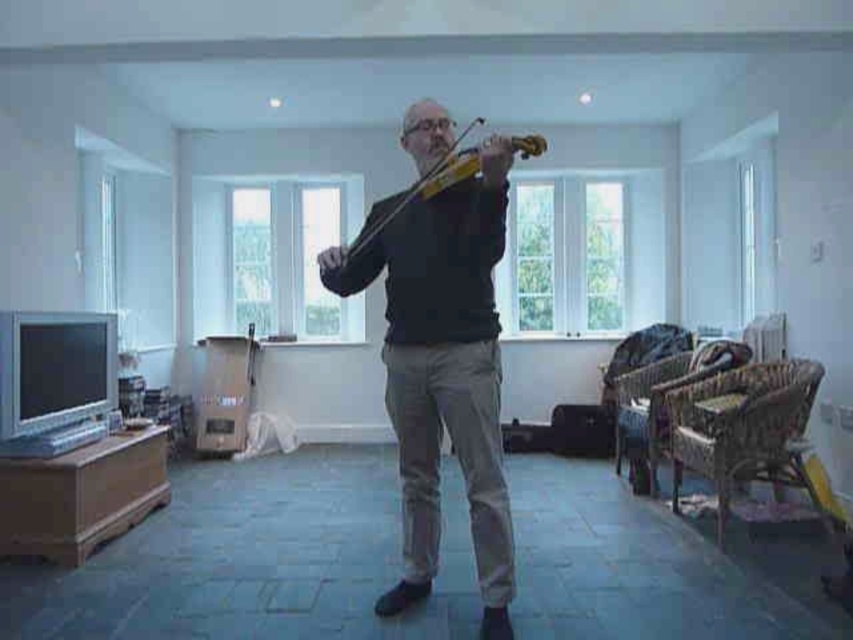
You are standing in the room and want to walk from the point at coordinates point (450,324) to the point at coordinates point (457,160). Which direction should you move in?

You should move to the left because point (450,324) is in front of point (457,160), meaning it is closer to you. To reach the point at (457,160), you need to move backward or to the left depending on your orientation. However, based on the spatial relationship provided, moving left would align with the direction from the first point to the second.

Based on the photo, you are an interior designer observing the room and want to ensure that the dark gray sweater at center does not cover the wooden violin at center when arranging furniture. Based on their positions, is this a concern?

Result: The dark gray sweater at center is located below the wooden violin at center, so it will not cover the violin when arranging furniture.